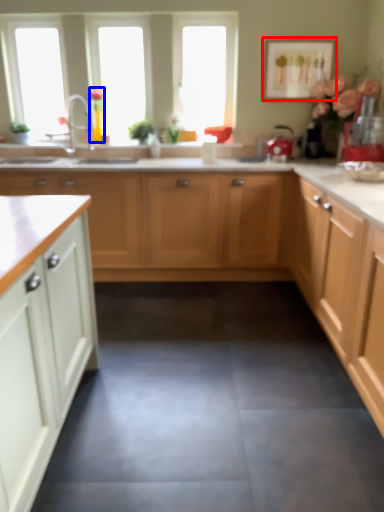
Question: Among these objects, which one is farthest to the camera, picture frame (highlighted by a red box) or flower (highlighted by a blue box)?

Choices:
 (A) picture frame
 (B) flower

Answer: (B)